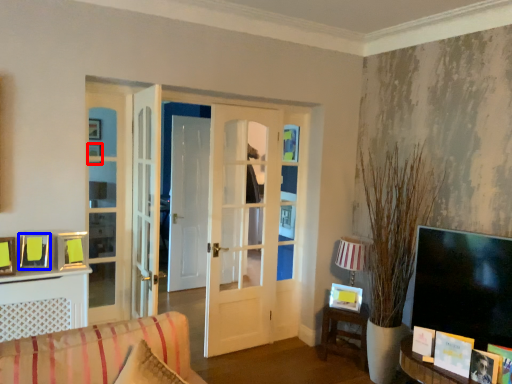
Question: Which of the following is the farthest to the observer, picture frame (highlighted by a red box) or picture frame (highlighted by a blue box)?

Choices:
 (A) picture frame
 (B) picture frame

Answer: (A)